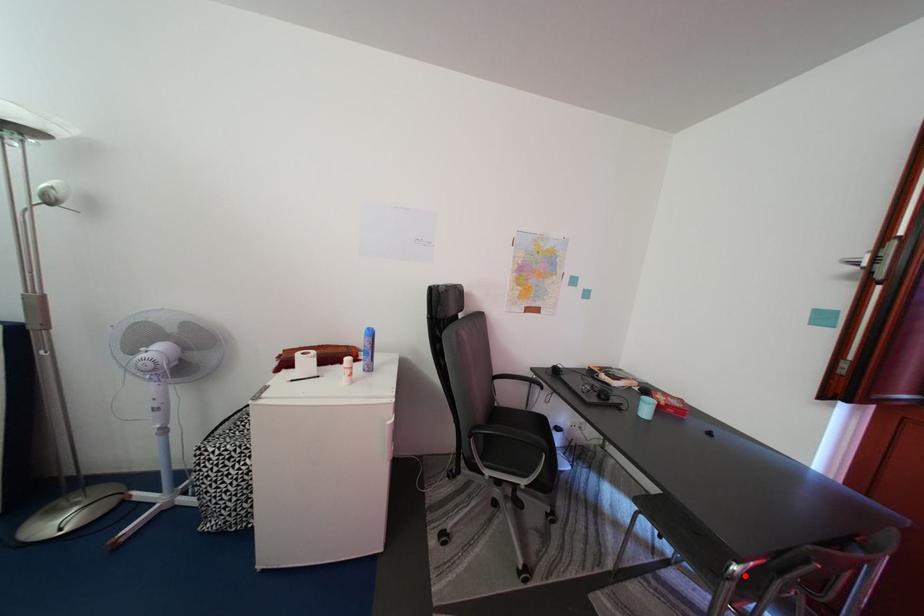
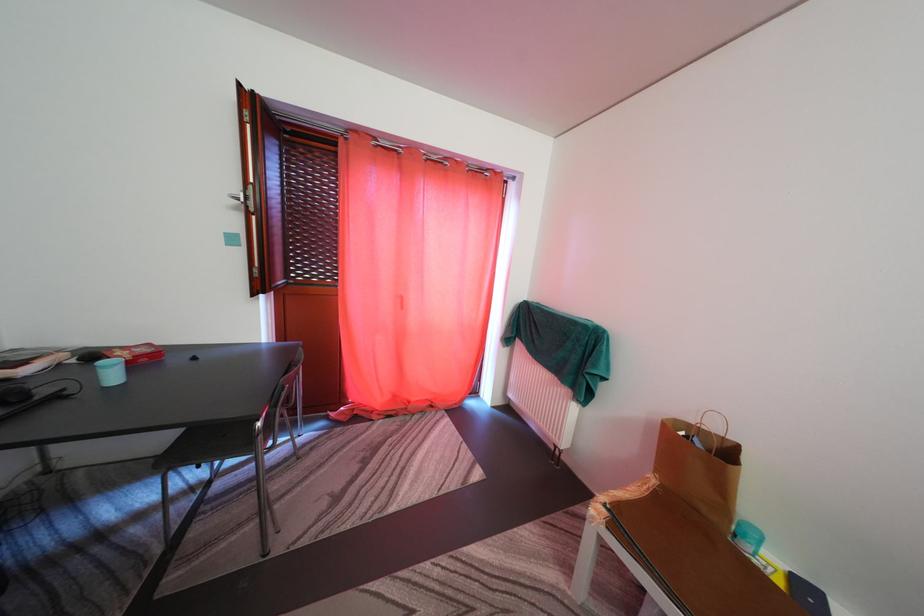
In the second image, find the point that corresponds to the highlighted location in the first image.

(268, 431)